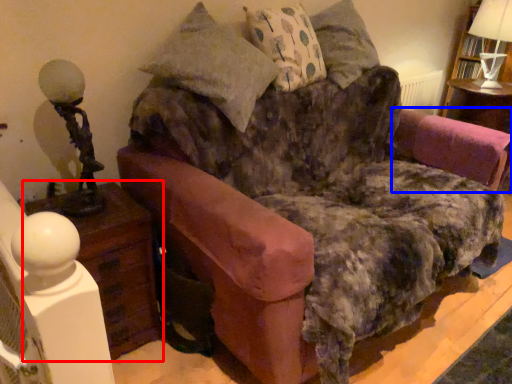
Question: Which point is closer to the camera, nightstand (highlighted by a red box) or swivel chair (highlighted by a blue box)?

Choices:
 (A) nightstand
 (B) swivel chair

Answer: (A)